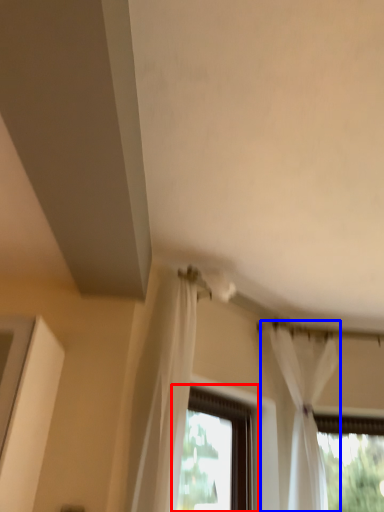
Question: Among these objects, which one is farthest to the camera, window (highlighted by a red box) or curtain (highlighted by a blue box)?

Choices:
 (A) window
 (B) curtain

Answer: (B)